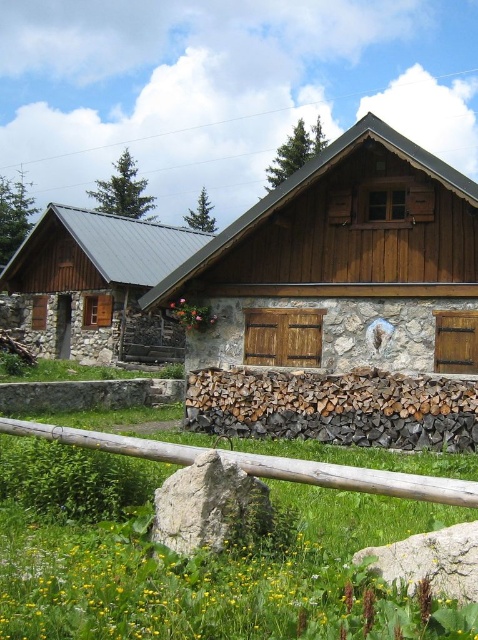
You are standing in front of the stone cabin at left and want to walk to the brown wooden fence at lower center. Which direction should you move to get closer to the fence?

You should move forward towards the brown wooden fence at lower center because the stone cabin at left is further to the viewer than the brown wooden fence at lower center, meaning the fence is closer to your current position.

Consider the image. You are standing in the middle of a field facing the stone cabin at left and the brown wooden fence at lower center. Which object is positioned to the left of the other?

The stone cabin at left is positioned to the left of the brown wooden fence at lower center.